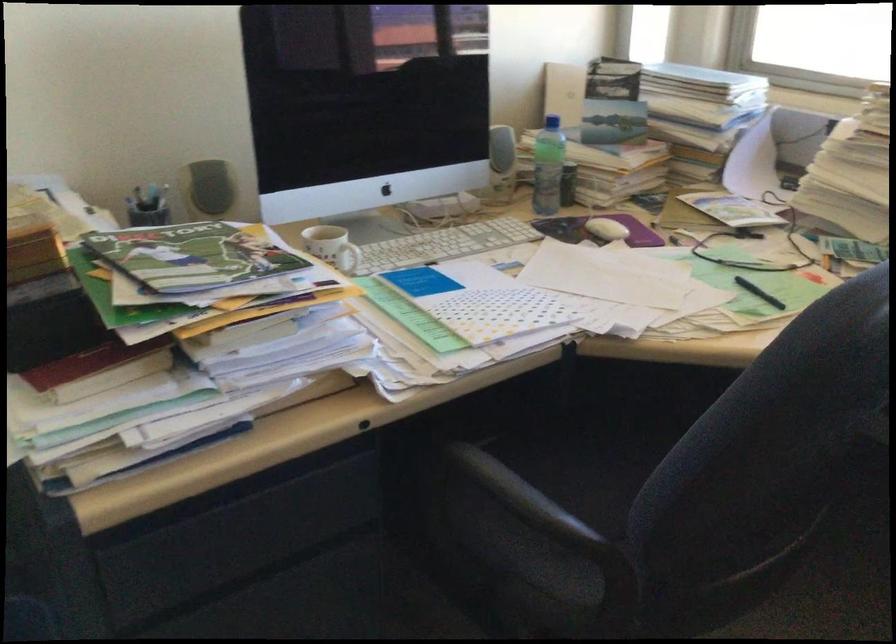
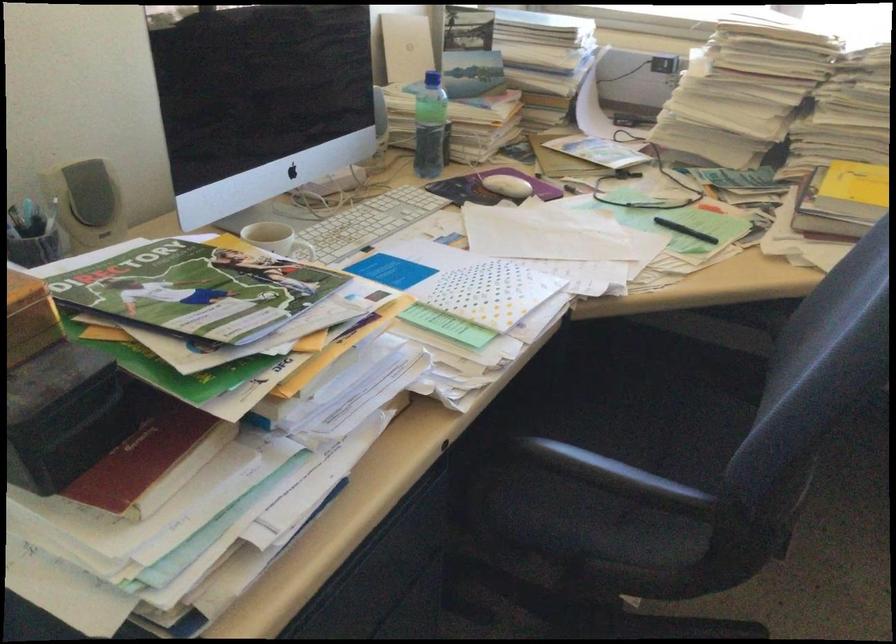
Locate, in the second image, the point that corresponds to pixel 728 222 in the first image.

(610, 166)